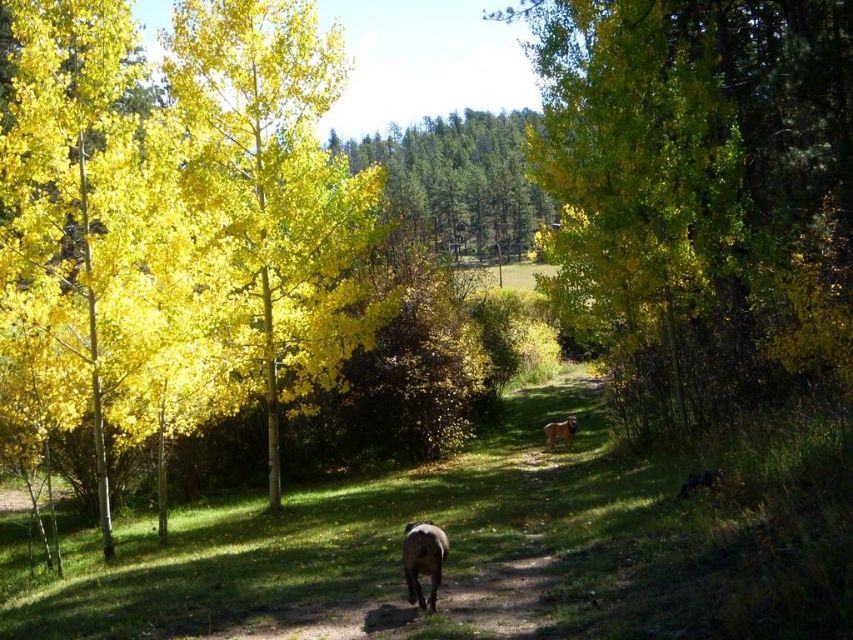
You are standing on the dirt path in the autumn forest scene. You see two points marked on the path. One is at point (410,602) and the other at point (566,417). If you are facing the direction the path is going, which point is closer to you?

Point (410,602) is in front of point (566,417), so if you are facing the direction the path is going, the point (410,602) is closer to you.

You are standing on the dirt path in the autumn forest. You see a yellow leafy tree at center and a brown furry dog at lower center. Which object is positioned to the right of the other?

The yellow leafy tree at center is to the right of the brown furry dog at lower center.